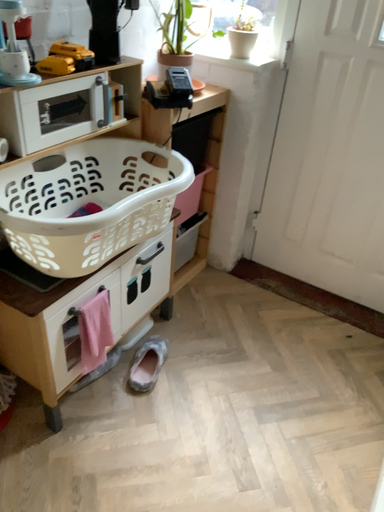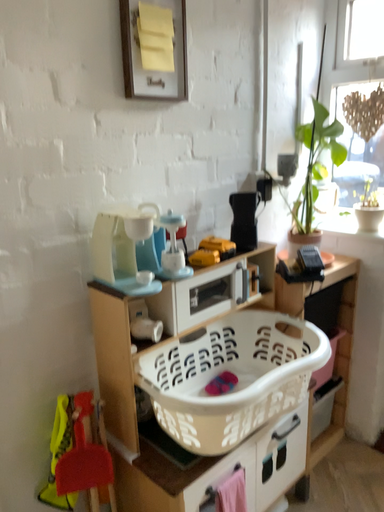
Question: Which way did the camera rotate in the video?

Choices:
 (A) rotated right
 (B) rotated left

Answer: (B)